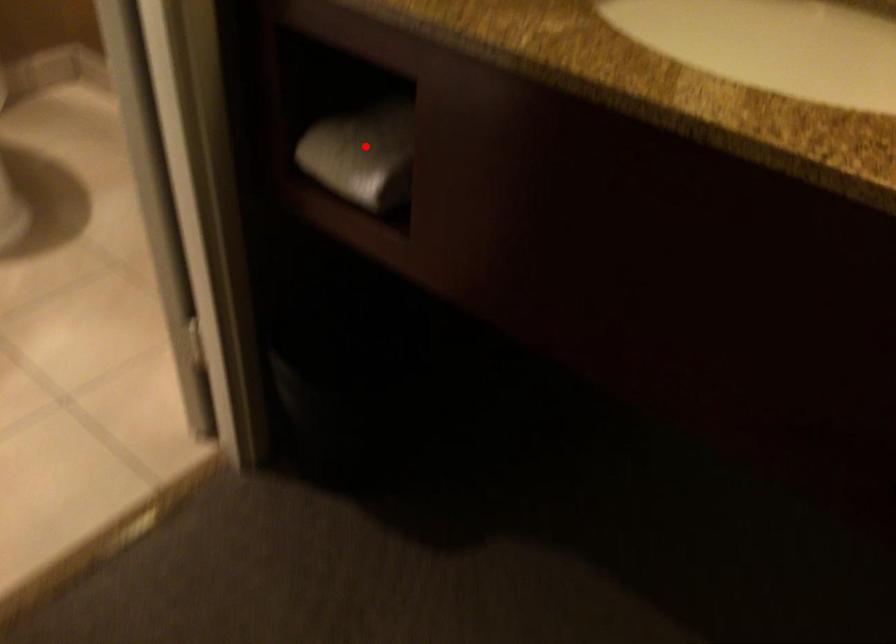
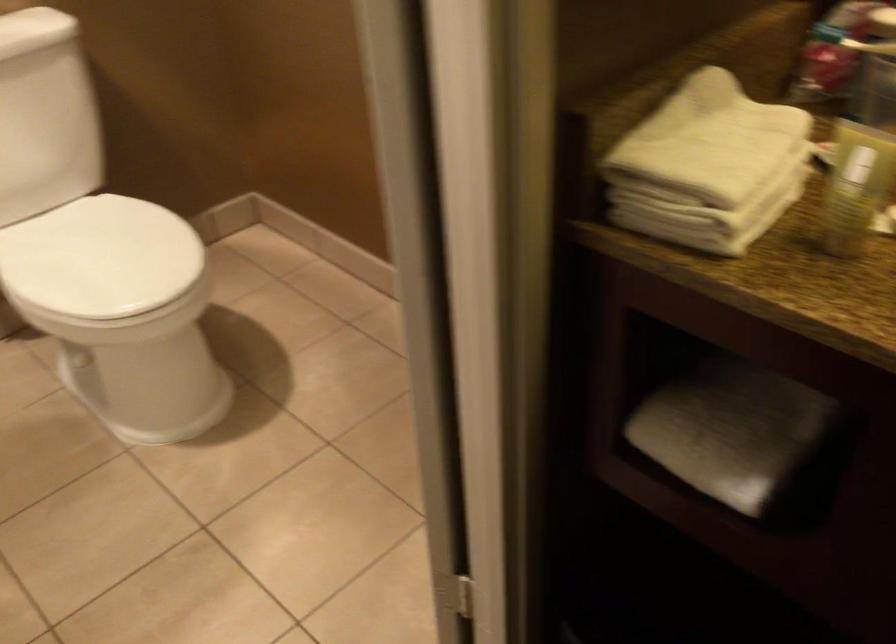
The point at the highlighted location is marked in the first image. Where is the corresponding point in the second image?

(730, 431)